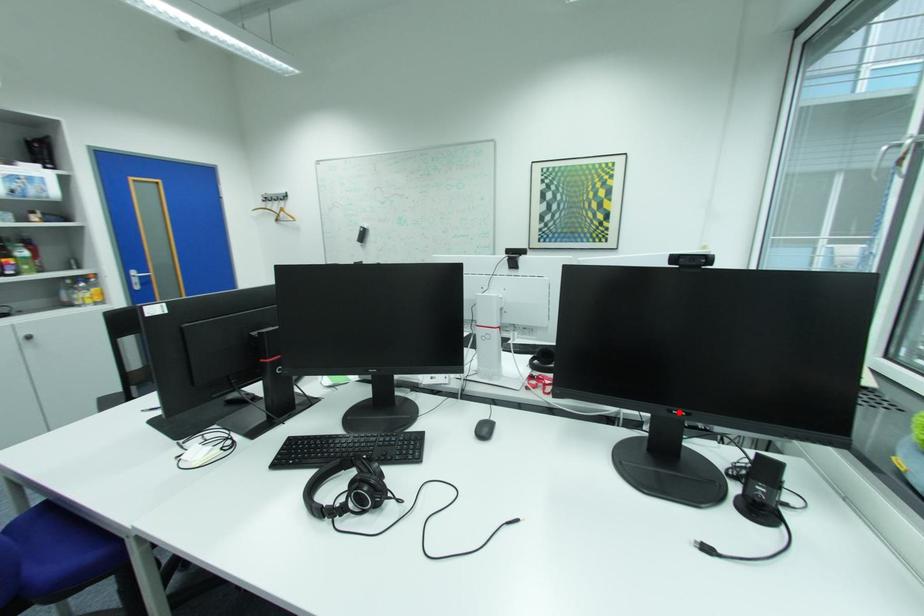
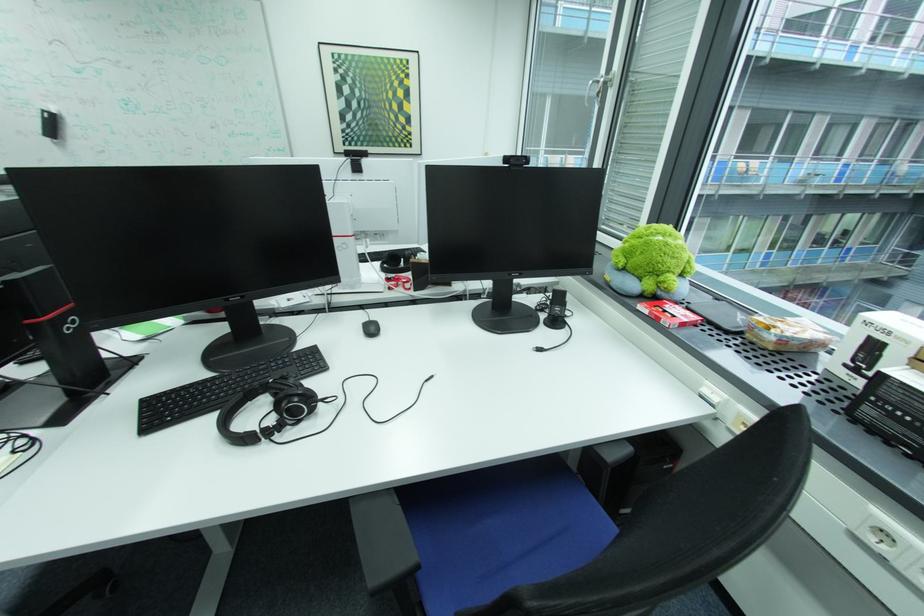
Locate, in the second image, the point that corresponds to the highlighted location in the first image.

(518, 275)